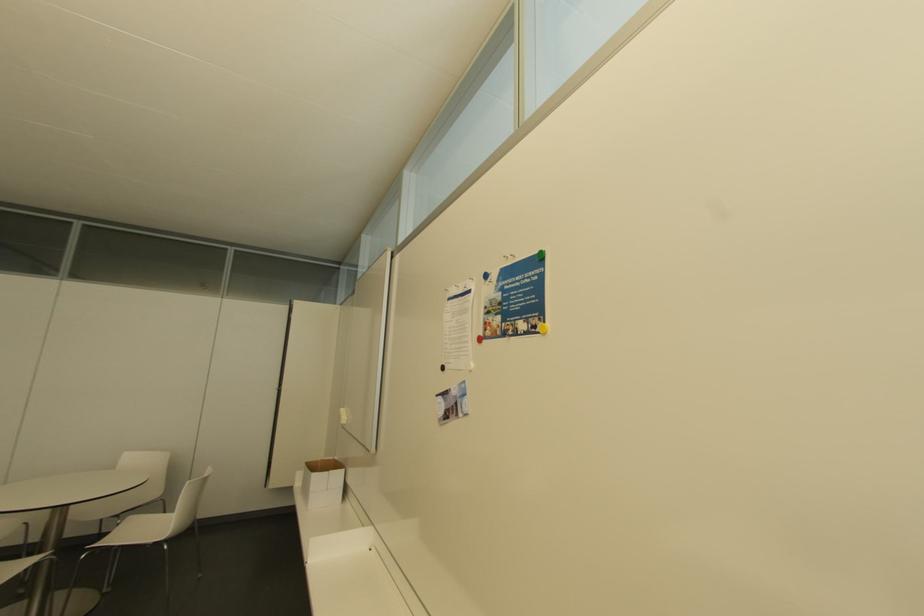
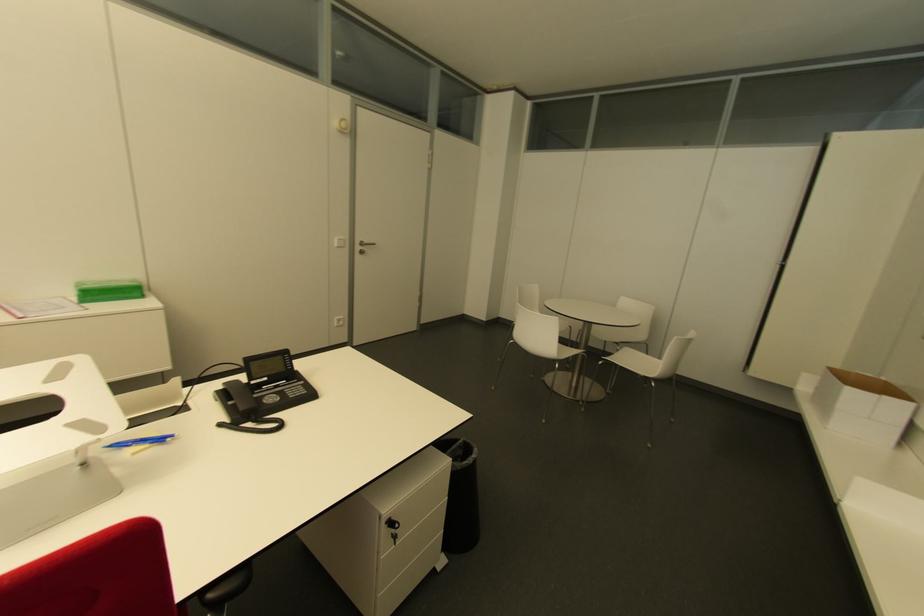
The images are taken continuously from a first-person perspective. In which direction is your viewpoint rotating?

The rotation direction of the camera is left-down.